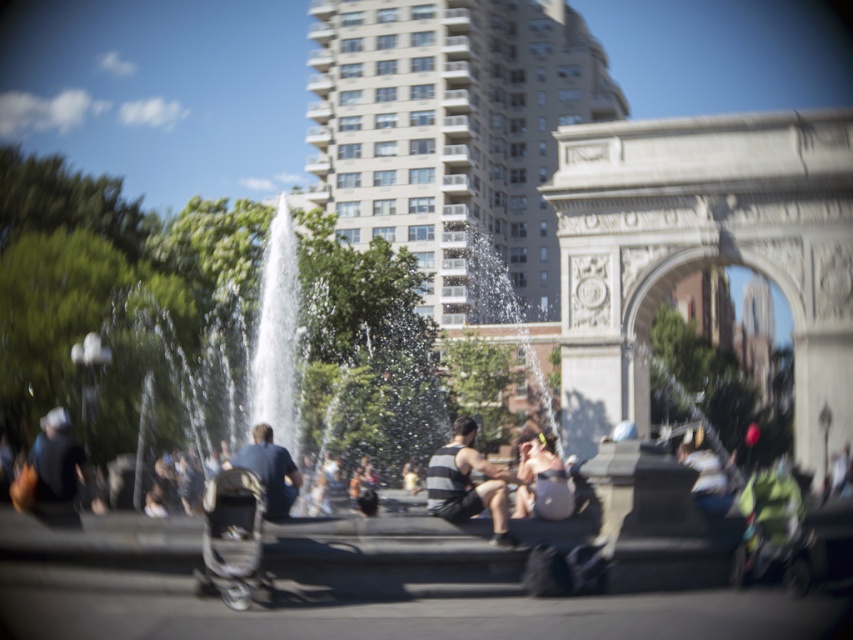
You are standing at the point closest to the archway in the park scene. There are two points marked in the image. Which point, point (527,467) or point (271,502), is farther away from you?

Point (527,467) is behind point (271,502), so it is farther away from you.

You are a photographer trying to capture a closeup of the striped fabric tank top at center and the matte black shorts at center. Since you want to focus on the tank top, which object should you adjust your camera focus to prioritize?

The striped fabric tank top at center is bigger than matte black shorts at center, so you should adjust your camera focus to prioritize the striped fabric tank top at center since it is larger and likely the main subject.